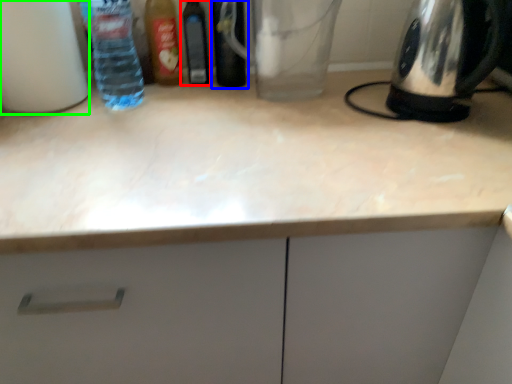
Question: Which is farther away from bottle (highlighted by a red box)? bottle (highlighted by a blue box) or bottle (highlighted by a green box)?

Choices:
 (A) bottle
 (B) bottle

Answer: (B)